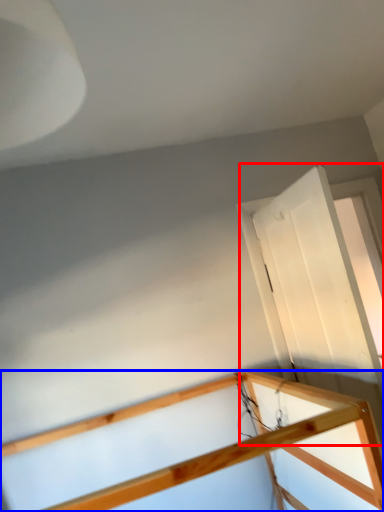
Question: Which of the following is the farthest to the observer, glass door (highlighted by a red box) or rail (highlighted by a blue box)?

Choices:
 (A) glass door
 (B) rail

Answer: (A)